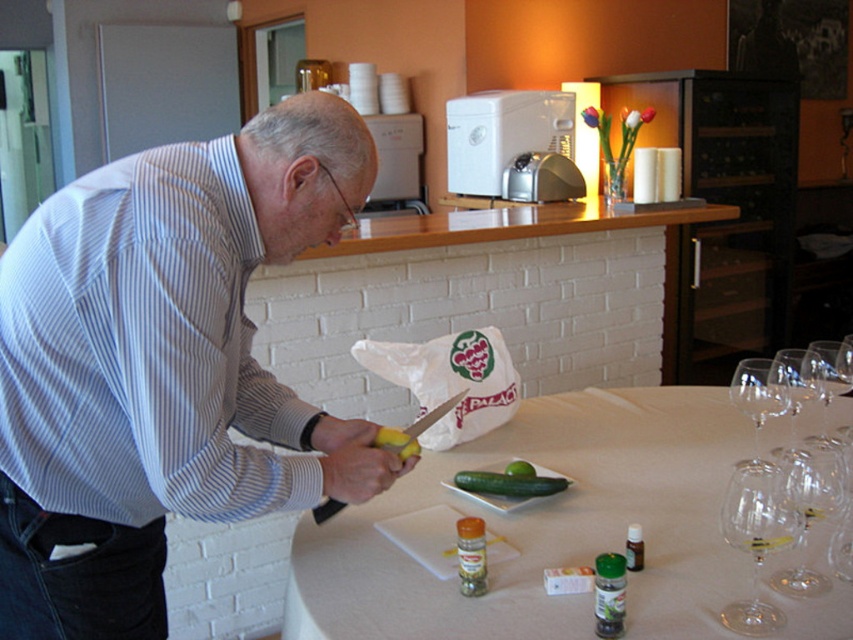
How distant is white paper bag at center from transparent glass wine glass at lower right?

white paper bag at center is 32.20 inches from transparent glass wine glass at lower right.

Is white paper bag at center to the right of transparent glass wine glass at lower right from the viewer's perspective?

Incorrect, white paper bag at center is not on the right side of transparent glass wine glass at lower right.

Is point (426, 346) positioned in front of point (743, 609)?

No, (426, 346) is further to viewer.

At what (x,y) coordinates should I click in order to perform the action: click on white paper bag at center. Please return your answer as a coordinate pair (x, y). Looking at the image, I should click on (450, 380).

From the picture: Does transparent glass wine glass at lower right appear on the left side of transparent glass wine glass at upper right?

Correct, you'll find transparent glass wine glass at lower right to the left of transparent glass wine glass at upper right.

Can you confirm if transparent glass wine glass at lower right is thinner than transparent glass wine glass at upper right?

Yes, transparent glass wine glass at lower right is thinner than transparent glass wine glass at upper right.

Who is more forward, (737, 544) or (746, 403)?

Point (737, 544) is in front.

The height and width of the screenshot is (640, 853). Identify the location of transparent glass wine glass at lower right. (757, 541).

Is clear glass wine glass at right further to the viewer compared to green smooth pickle at center?

No, clear glass wine glass at right is in front of green smooth pickle at center.

Is clear glass wine glass at right smaller than green smooth pickle at center?

No, clear glass wine glass at right is not smaller than green smooth pickle at center.

Which is in front, point (834, 378) or point (508, 493)?

Positioned in front is point (508, 493).

At what (x,y) coordinates should I click in order to perform the action: click on clear glass wine glass at right. Please return your answer as a coordinate pair (x, y). The height and width of the screenshot is (640, 853). Looking at the image, I should click on (831, 384).